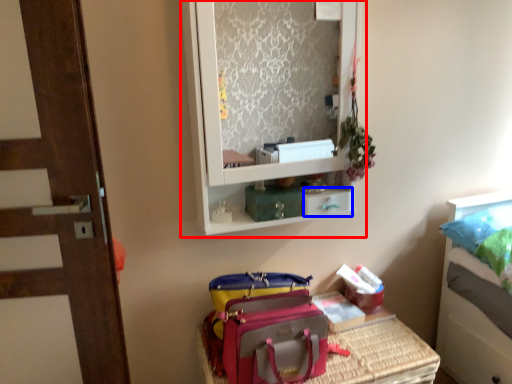
Question: Which of the following is the farthest to the observer, medicine cabinet (highlighted by a red box) or drawer (highlighted by a blue box)?

Choices:
 (A) medicine cabinet
 (B) drawer

Answer: (B)